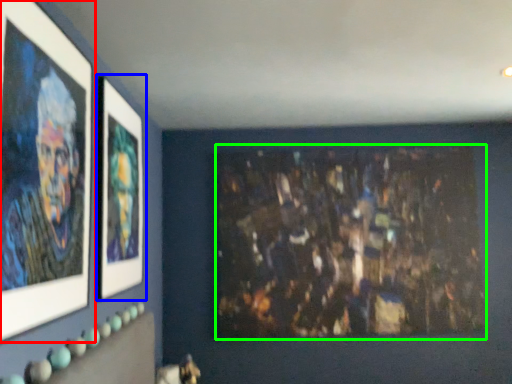
Question: Which is farther away from picture frame (highlighted by a red box)? picture frame (highlighted by a blue box) or art (highlighted by a green box)?

Choices:
 (A) picture frame
 (B) art

Answer: (B)